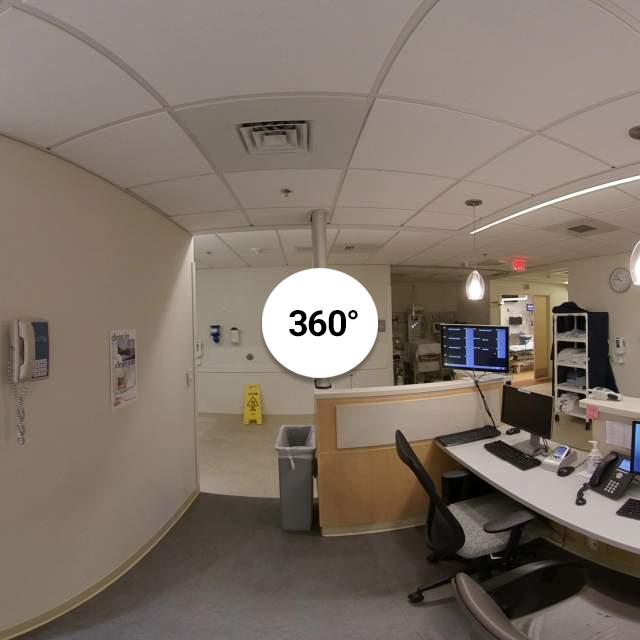
I want to click on vent, so click(x=273, y=137).